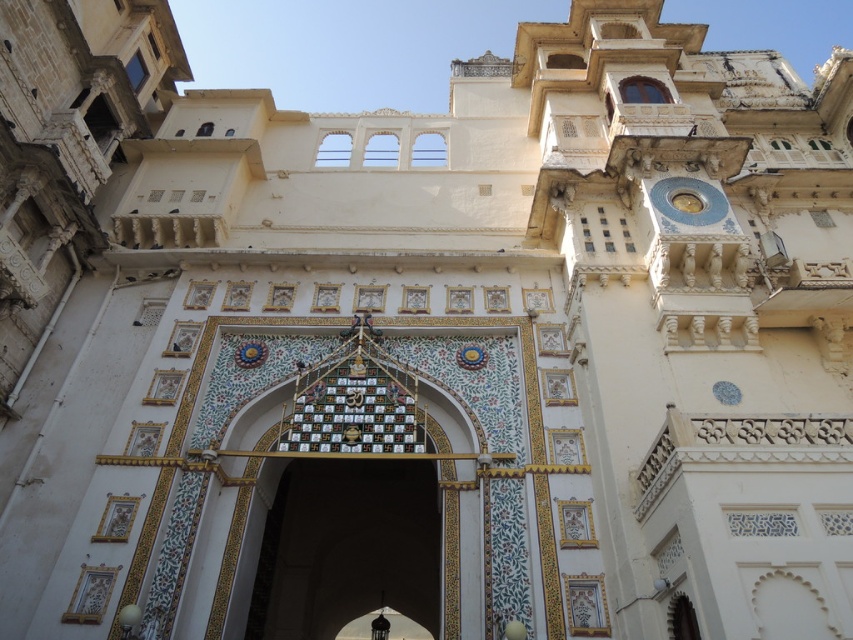
You are standing in front of the grand architectural structure and want to take a photo that includes both the white marble archway at center and the gold metallic clock at upper right. Which object should you position closer to the front of your camera frame to ensure both are in focus?

You should position the white marble archway at center closer to the front of your camera frame since it is closer to the viewer than the gold metallic clock at upper right, ensuring both are in focus.

You are an architect analyzing the symmetry of the entrance area. Which object, the white marble archway at center or the gold metallic clock at upper right, is taller?

The white marble archway at center is taller than the gold metallic clock at upper right according to the description.

Consider the image. You are standing in front of the grand architectural structure and want to determine the relative positions of two points marked on the facade. Which point, point [320,611] or point [708,184], is closer to you?

Point [320,611] is closer to you because it is further to the viewer than point [708,184].